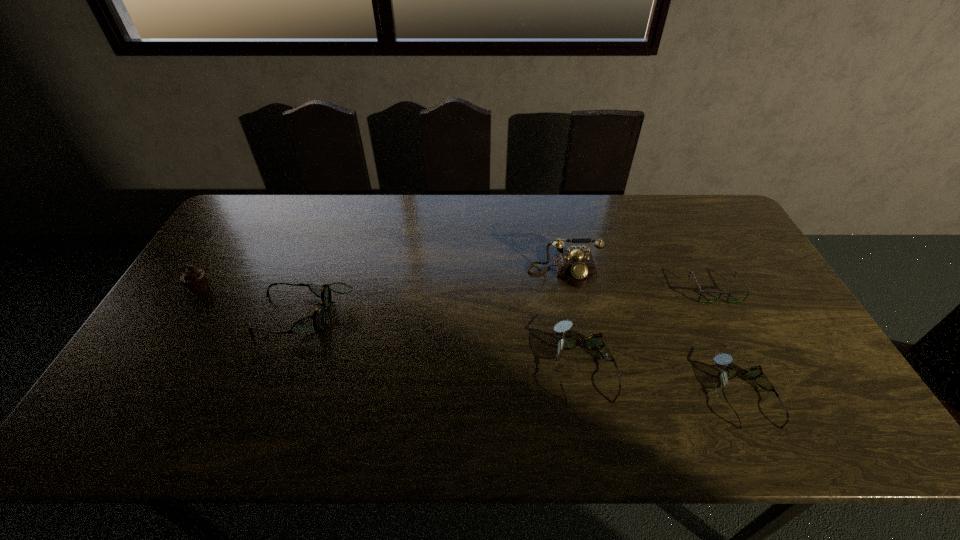
If equal spacing is the goal by inserting an additional spectacles among them, please point out a vacant space for this new spectacles. Please provide its 2D coordinates. Your answer should be formatted as a tuple, i.e. [(x, y)], where the tuple contains the x and y coordinates of a point satisfying the conditions above.

[(437, 339)]